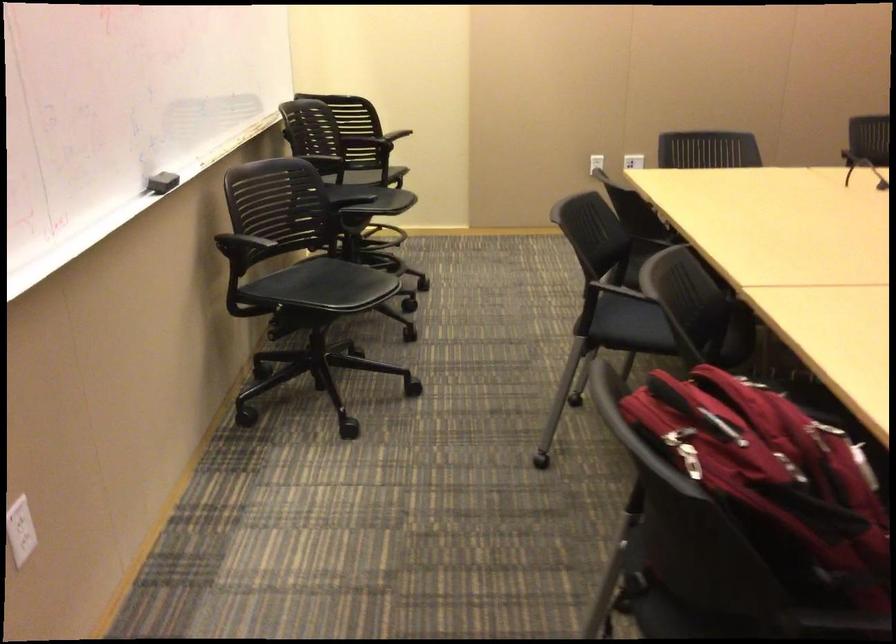
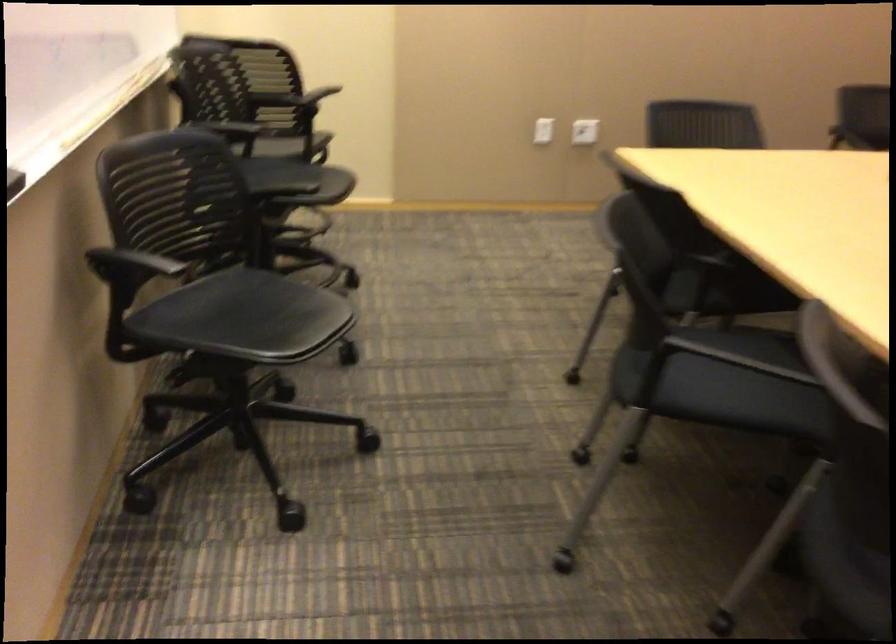
Which direction would the cameraman need to move to produce the second image?

Result: The cameraman walked toward left, forward.